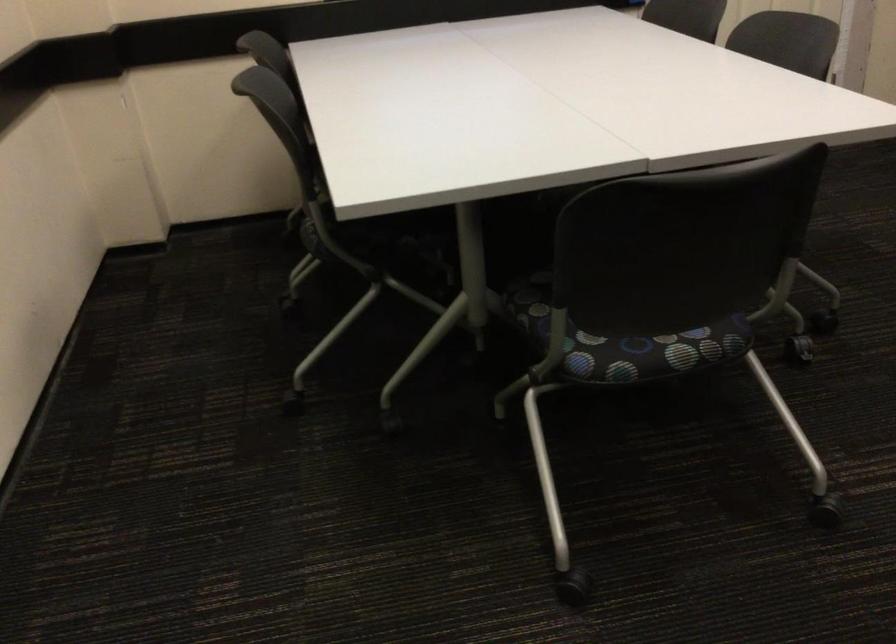
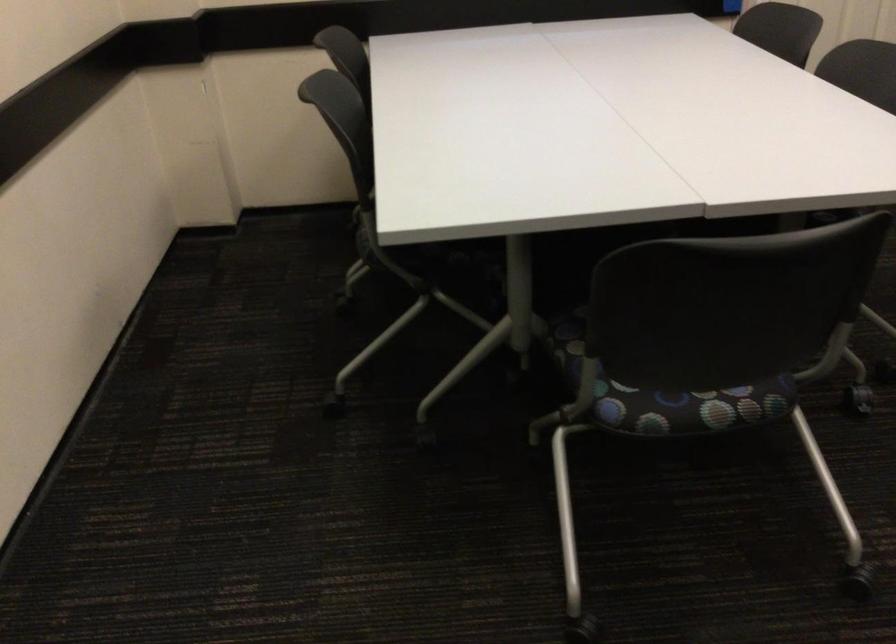
Where in the second image is the point corresponding to point 658,353 from the first image?

(688, 406)